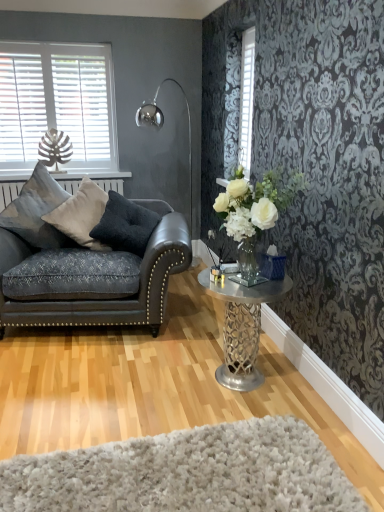
This screenshot has width=384, height=512. I want to click on velvet cushion at left, placed as the first pillow when sorted from left to right, so click(37, 211).

Where is `velvet cushion at left, which is the second pillow in left-to-right order`? velvet cushion at left, which is the second pillow in left-to-right order is located at coordinates (81, 214).

What do you see at coordinates (81, 214) in the screenshot?
I see `velvet cushion at left, which is the second pillow in left-to-right order` at bounding box center [81, 214].

What is the approximate width of white textured blinds at upper center, the 2th window in the back-to-front sequence?

white textured blinds at upper center, the 2th window in the back-to-front sequence, is 1.42 inches in width.

Describe the element at coordinates (256, 218) in the screenshot. The image size is (384, 512). I see `white glass vase at center right` at that location.

Measure the distance between point (102, 111) and camera.

The depth of point (102, 111) is 3.98 meters.

The image size is (384, 512). Identify the location of velvet cushion at left, which appears as the 3th pillow when viewed from the right. (37, 211).

Considering the sizes of white glass vase at center right and white textured blinds at upper center, arranged as the first window when viewed from the front, in the image, is white glass vase at center right bigger or smaller than white textured blinds at upper center, arranged as the first window when viewed from the front,?

In the image, white glass vase at center right appears to be larger than white textured blinds at upper center, arranged as the first window when viewed from the front.

Are white glass vase at center right and white textured blinds at upper center, the 2th window in the back-to-front sequence, far apart?

Actually, white glass vase at center right and white textured blinds at upper center, the 2th window in the back-to-front sequence, are a little close together.

From the image's perspective, between white glass vase at center right and white textured blinds at upper center, the first window from the right, which one is located above?

white textured blinds at upper center, the first window from the right, is shown above in the image.

Where is `studio couch that appears above the white shaggy rug at lower center (from the image's perspective)`? The image size is (384, 512). studio couch that appears above the white shaggy rug at lower center (from the image's perspective) is located at coordinates (83, 267).

In terms of height, does white shaggy rug at lower center look taller or shorter compared to dark gray leather couch at left?

Clearly, white shaggy rug at lower center is shorter compared to dark gray leather couch at left.

From the image's perspective, between white shaggy rug at lower center and dark gray leather couch at left, who is located below?

white shaggy rug at lower center is shown below in the image.

Is white shaggy rug at lower center oriented towards dark gray leather couch at left?

No, white shaggy rug at lower center is not aimed at dark gray leather couch at left.

Which object is closer to the camera taking this photo, metallic silver table at center or white wood blinds at upper left, the second window viewed from the right?

metallic silver table at center is more forward.

Based on their positions, is metallic silver table at center located to the left or right of white wood blinds at upper left, the second window viewed from the right?

Clearly, metallic silver table at center is on the right of white wood blinds at upper left, the second window viewed from the right, in the image.

Which of these two, metallic silver table at center or white wood blinds at upper left, which appears as the first window when viewed from the back, is bigger?

metallic silver table at center is bigger.

Does metallic silver table at center have a lesser height compared to white wood blinds at upper left, which appears as the first window when viewed from the back?

Yes, metallic silver table at center is shorter than white wood blinds at upper left, which appears as the first window when viewed from the back.

Where is `the 1st window behind the velvet cushion at left, the 2th pillow from the right`? This screenshot has width=384, height=512. the 1st window behind the velvet cushion at left, the 2th pillow from the right is located at coordinates (246, 99).

From the image's perspective, is velvet cushion at left, the 2th pillow from the right, positioned above or below white textured blinds at upper center, arranged as the first window when viewed from the front?

Based on their image positions, velvet cushion at left, the 2th pillow from the right, is located beneath white textured blinds at upper center, arranged as the first window when viewed from the front.

Considering the relative positions of velvet cushion at left, the 2th pillow from the right, and white textured blinds at upper center, acting as the second window starting from the left, in the image provided, is velvet cushion at left, the 2th pillow from the right, to the right of white textured blinds at upper center, acting as the second window starting from the left, from the viewer's perspective?

In fact, velvet cushion at left, the 2th pillow from the right, is to the left of white textured blinds at upper center, acting as the second window starting from the left.

Based on their sizes in the image, would you say velvet cushion at left, which is the second pillow in left-to-right order, is bigger or smaller than white textured blinds at upper center, acting as the second window starting from the left?

Clearly, velvet cushion at left, which is the second pillow in left-to-right order, is larger in size than white textured blinds at upper center, acting as the second window starting from the left.

From a real-world perspective, count 1st windows upward from the dark gray velvet pillow at left, which is the 1th pillow in right-to-left order, and point to it. Please provide its 2D coordinates.

[(246, 99)]

Are dark gray velvet pillow at left, marked as the 3th pillow in a left-to-right arrangement, and white textured blinds at upper center, the 2th window in the back-to-front sequence, beside each other?

They are not placed beside each other.

Between point (105, 229) and point (250, 58), which one is positioned in front?

The point (250, 58) is in front.

At what (x,y) coordinates should I click in order to perform the action: click on pillow that is the 1st object located below the velvet cushion at left, which appears as the 3th pillow when viewed from the right (from the image's perspective). Please return your answer as a coordinate pair (x, y). The width and height of the screenshot is (384, 512). Looking at the image, I should click on (81, 214).

Would you say velvet cushion at left, placed as the first pillow when sorted from left to right, is outside velvet cushion at left, which is the second pillow in left-to-right order?

That's incorrect, velvet cushion at left, placed as the first pillow when sorted from left to right, is not completely outside velvet cushion at left, which is the second pillow in left-to-right order.

Is velvet cushion at left, which appears as the 3th pillow when viewed from the right, behind velvet cushion at left, the 2th pillow from the right?

No, velvet cushion at left, which appears as the 3th pillow when viewed from the right, is in front of velvet cushion at left, the 2th pillow from the right.

Does point (26, 226) come closer to viewer compared to point (67, 234)?

Yes, point (26, 226) is closer to viewer.

Is white glass vase at center right positioned with its back to velvet cushion at left, the 2th pillow from the right?

white glass vase at center right does not have its back to velvet cushion at left, the 2th pillow from the right.

Is white glass vase at center right directly adjacent to velvet cushion at left, the 2th pillow from the right?

white glass vase at center right is not next to velvet cushion at left, the 2th pillow from the right, and they're not touching.

Image resolution: width=384 pixels, height=512 pixels. Identify the location of floral arrangement lying on the right of velvet cushion at left, the 2th pillow from the right. (256, 218).

How far apart are white glass vase at center right and velvet cushion at left, which is the second pillow in left-to-right order?

white glass vase at center right and velvet cushion at left, which is the second pillow in left-to-right order, are 4.17 feet apart.

Identify the location of floral arrangement located underneath the white textured blinds at upper center, arranged as the first window when viewed from the front (from a real-world perspective). (256, 218).

Where is `plain below the dark gray leather couch at left (from the image's perspective)`? The height and width of the screenshot is (512, 384). plain below the dark gray leather couch at left (from the image's perspective) is located at coordinates (187, 473).

Which object lies nearer to the anchor point white wood blinds at upper left, which appears as the first window when viewed from the back, dark gray velvet pillow at left, marked as the 3th pillow in a left-to-right arrangement, or velvet cushion at left, which appears as the 3th pillow when viewed from the right?

Based on the image, velvet cushion at left, which appears as the 3th pillow when viewed from the right, appears to be nearer to white wood blinds at upper left, which appears as the first window when viewed from the back.

Based on their spatial positions, is metallic silver table at center or white shaggy rug at lower center closer to metallic silver floor lamp at upper left?

The object closer to metallic silver floor lamp at upper left is metallic silver table at center.

Estimate the real-world distances between objects in this image. Which object is closer to white glass vase at center right, white textured blinds at upper center, the first window from the right, or metallic silver floor lamp at upper left?

white textured blinds at upper center, the first window from the right, lies closer to white glass vase at center right than the other object.

Looking at the image, which one is located closer to metallic silver table at center, white shaggy rug at lower center or dark gray leather couch at left?

Based on the image, white shaggy rug at lower center appears to be nearer to metallic silver table at center.

Looking at the image, which one is located further to white shaggy rug at lower center, velvet cushion at left, the 2th pillow from the right, or dark gray velvet pillow at left, which is the 1th pillow in right-to-left order?

velvet cushion at left, the 2th pillow from the right.

Estimate the real-world distances between objects in this image. Which object is further from dark gray leather couch at left, white glass vase at center right or white wood blinds at upper left, which appears as the first window when viewed from the back?

white wood blinds at upper left, which appears as the first window when viewed from the back.

Consider the image. When comparing their distances from metallic silver table at center, does white textured blinds at upper center, arranged as the first window when viewed from the front, or white wood blinds at upper left, marked as the first window in a left-to-right arrangement, seem closer?

Based on the image, white textured blinds at upper center, arranged as the first window when viewed from the front, appears to be nearer to metallic silver table at center.

Based on their spatial positions, is metallic silver floor lamp at upper left or velvet cushion at left, the 2th pillow from the right, further from metallic silver table at center?

The object further to metallic silver table at center is metallic silver floor lamp at upper left.

Image resolution: width=384 pixels, height=512 pixels. I want to click on studio couch located between velvet cushion at left, placed as the first pillow when sorted from left to right, and metallic silver floor lamp at upper left in the left-right direction, so click(x=83, y=267).

You are a GUI agent. You are given a task and a screenshot of the screen. Output one action in this format:
    pyautogui.click(x=<x>, y=<y>)
    Task: Click on the studio couch between white shaggy rug at lower center and white wood blinds at upper left, marked as the first window in a left-to-right arrangement, from front to back
    The width and height of the screenshot is (384, 512).
    Given the screenshot: What is the action you would take?
    pyautogui.click(x=83, y=267)

I want to click on coffee table between white glass vase at center right and white shaggy rug at lower center vertically, so click(x=242, y=327).

This screenshot has width=384, height=512. Find the location of `lamp between white wood blinds at upper left, marked as the first window in a left-to-right arrangement, and metallic silver table at center from top to bottom`. lamp between white wood blinds at upper left, marked as the first window in a left-to-right arrangement, and metallic silver table at center from top to bottom is located at coordinates (162, 126).